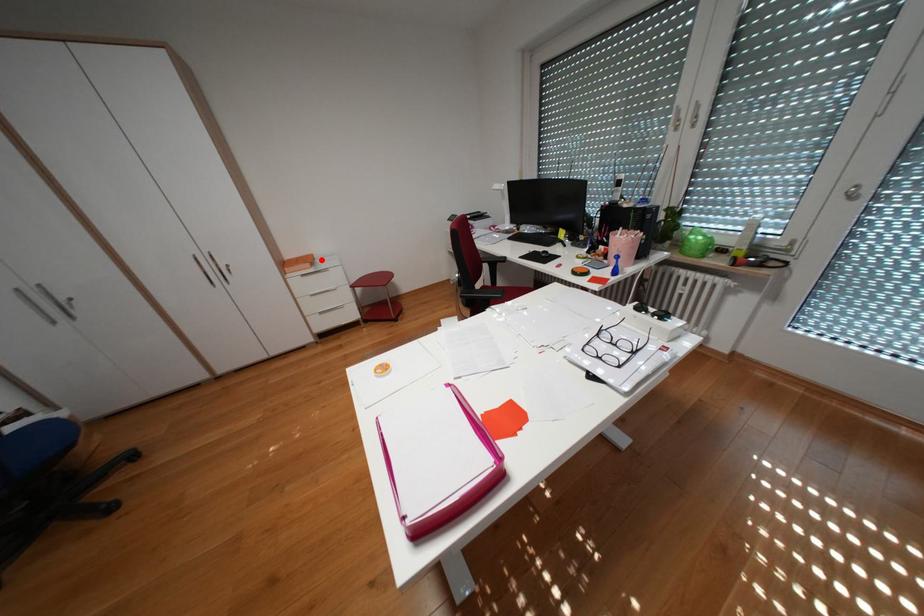
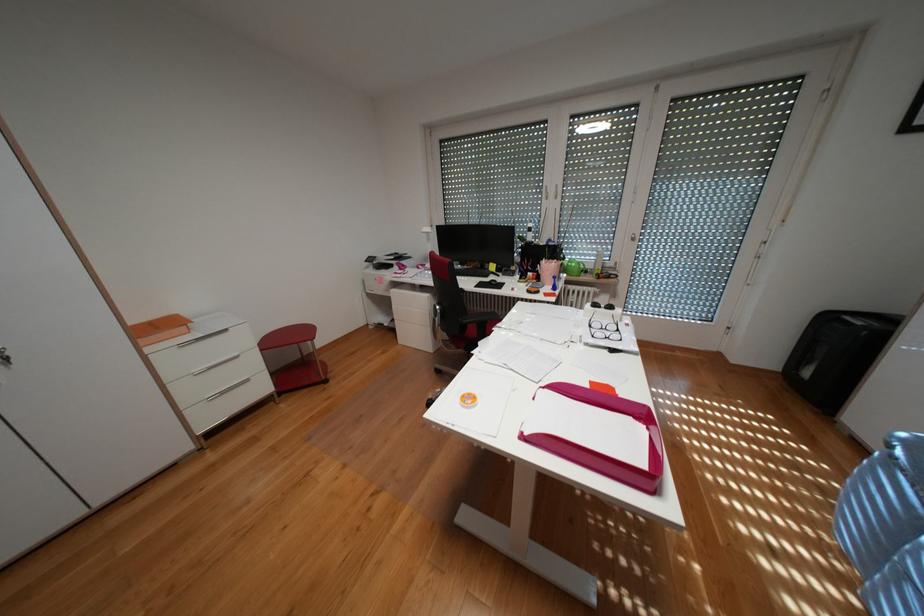
The point at the highlighted location is marked in the first image. Where is the corresponding point in the second image?

(184, 323)